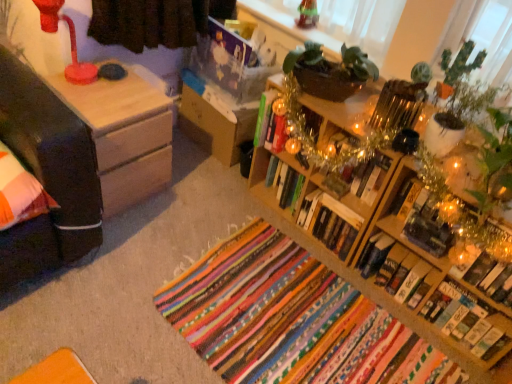
Locate an element on the screen. This screenshot has height=384, width=512. vacant space that's between wooden nightstand at left and hardcover book at center-right, the 2th book viewed from the left is located at coordinates (213, 212).